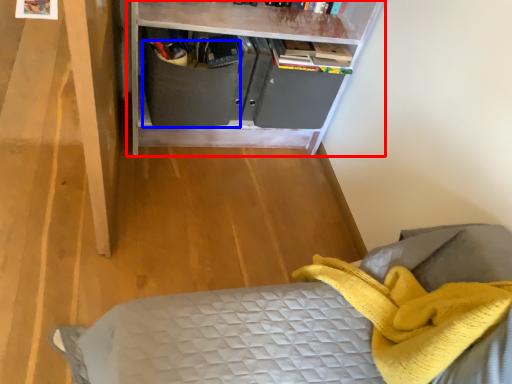
Question: Among these objects, which one is nearest to the camera, shelf (highlighted by a red box) or drawer (highlighted by a blue box)?

Choices:
 (A) shelf
 (B) drawer

Answer: (A)